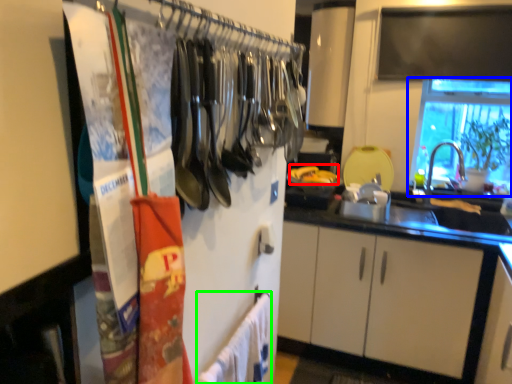
Question: Based on their relative distances, which object is farther from food (highlighted by a red box)? Choose from window (highlighted by a blue box) and bath towel (highlighted by a green box).

Choices:
 (A) window
 (B) bath towel

Answer: (B)